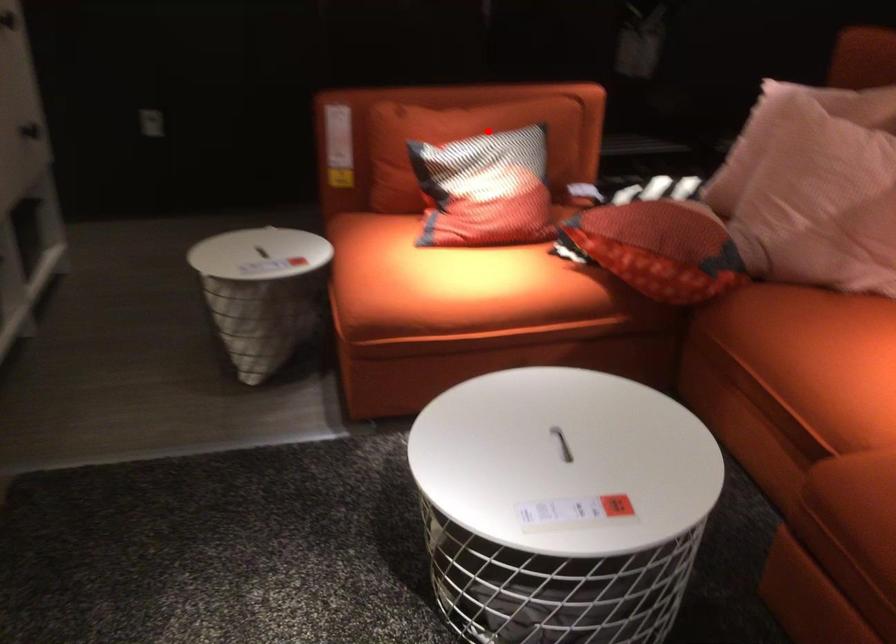
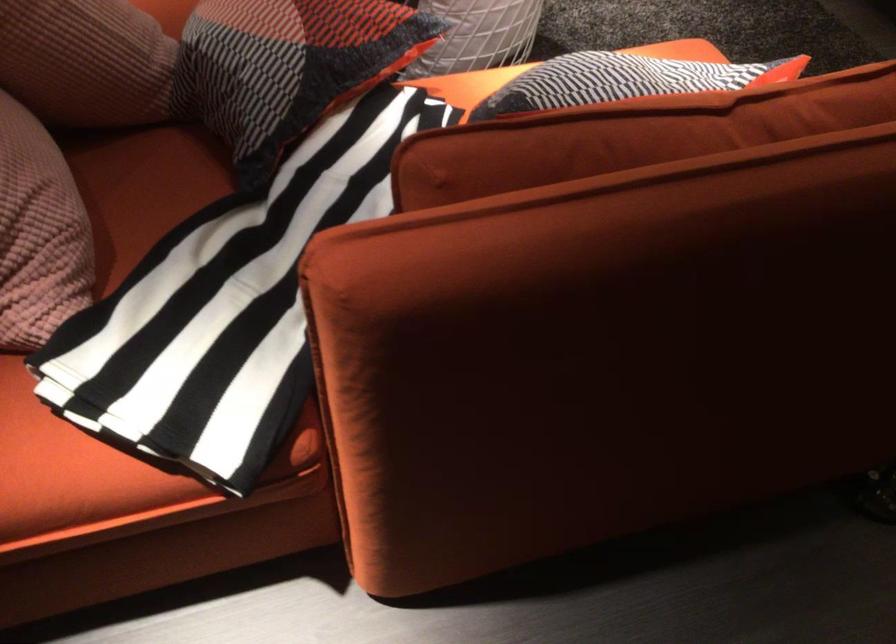
In the second image, find the point that corresponds to the highlighted location in the first image.

(623, 80)